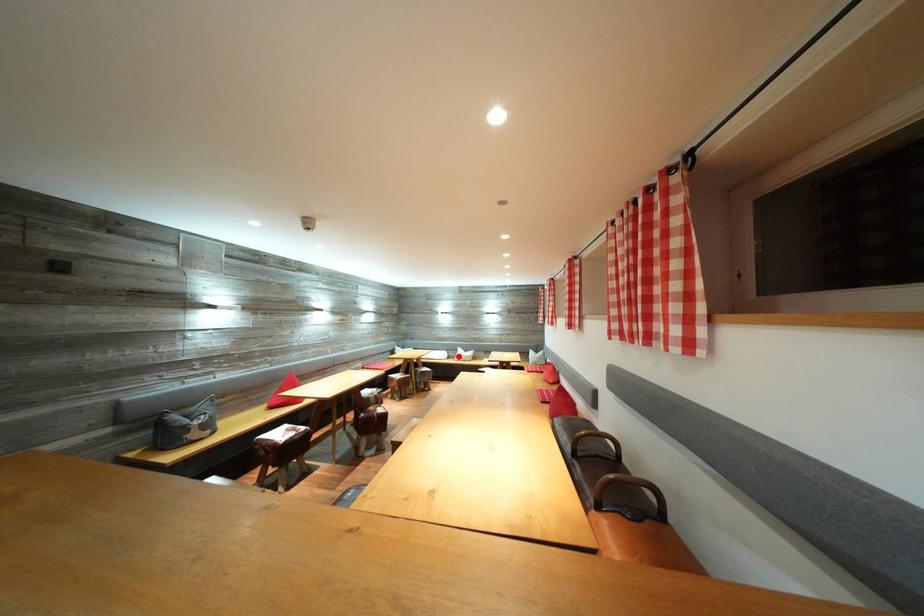
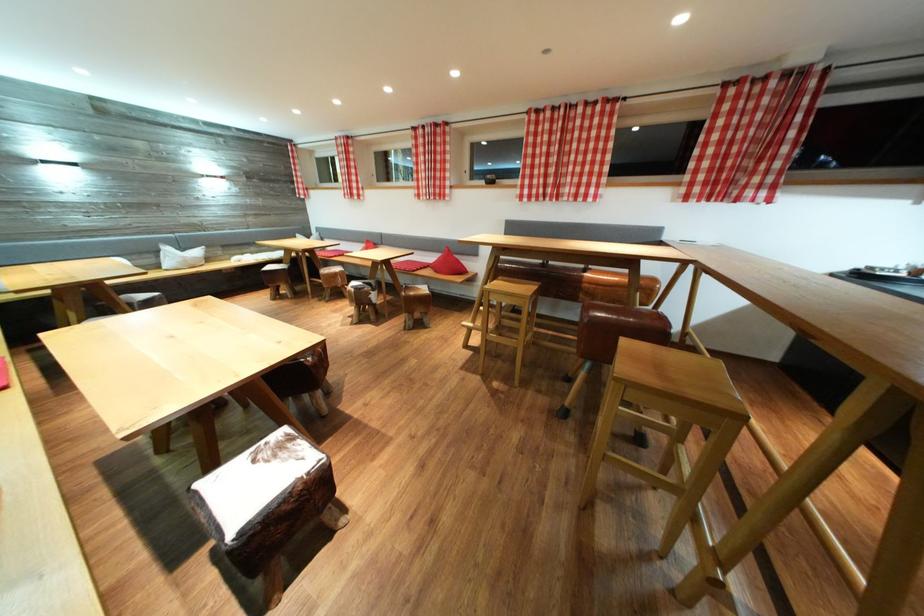
Find the pixel in the second image that matches the highlighted location in the first image.

(151, 259)